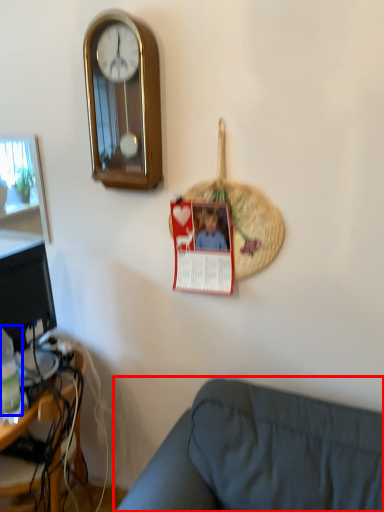
Question: Which of the following is the closest to the observer, studio couch (highlighted by a red box) or bottle (highlighted by a blue box)?

Choices:
 (A) studio couch
 (B) bottle

Answer: (A)